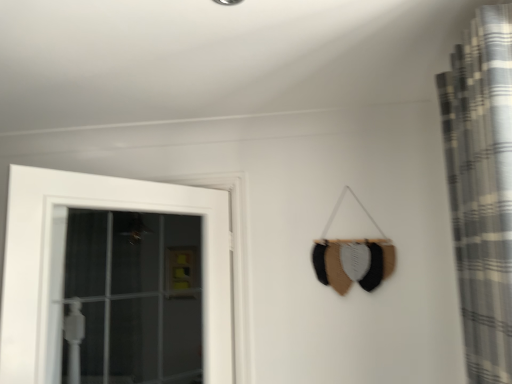
The width and height of the screenshot is (512, 384). Describe the element at coordinates (105, 209) in the screenshot. I see `white wooden door at left` at that location.

The width and height of the screenshot is (512, 384). Identify the location of white wooden door at left. (105, 209).

What is the approximate width of white wooden door at left?

white wooden door at left is 6.07 inches wide.

In order to face white wooden door at left, should I rotate leftwards or rightwards?

Turn left approximately 15.599 degrees to face it.

What do you see at coordinates (482, 187) in the screenshot? I see `plaid fabric curtain at right` at bounding box center [482, 187].

Locate an element on the screen. Image resolution: width=512 pixels, height=384 pixels. plaid fabric curtain at right is located at coordinates (482, 187).

What is the approximate width of plaid fabric curtain at right?

The width of plaid fabric curtain at right is 12.69 inches.

Image resolution: width=512 pixels, height=384 pixels. In order to click on white wooden door at left in this screenshot , I will do `click(105, 209)`.

In the image, is white wooden door at left on the left side or the right side of plaid fabric curtain at right?

In the image, white wooden door at left appears on the left side of plaid fabric curtain at right.

Which object is more forward, white wooden door at left or plaid fabric curtain at right?

plaid fabric curtain at right is in front.

Is point (203, 269) closer or farther from the camera than point (452, 212)?

Clearly, point (203, 269) is more distant from the camera than point (452, 212).

From the image's perspective, is white wooden door at left on plaid fabric curtain at right?

No.

From a real-world perspective, who is located lower, white wooden door at left or plaid fabric curtain at right?

white wooden door at left.

In terms of width, does white wooden door at left look wider or thinner when compared to plaid fabric curtain at right?

white wooden door at left is thinner than plaid fabric curtain at right.

From their relative heights in the image, would you say white wooden door at left is taller or shorter than plaid fabric curtain at right?

white wooden door at left is shorter than plaid fabric curtain at right.

Between white wooden door at left and plaid fabric curtain at right, which one has smaller size?

With smaller size is white wooden door at left.

Would you say plaid fabric curtain at right is part of white wooden door at left's contents?

Definitely not — plaid fabric curtain at right is not inside white wooden door at left.

Is white wooden door at left positioned far away from plaid fabric curtain at right?

Yes, white wooden door at left and plaid fabric curtain at right are located far from each other.

Is white wooden door at left positioned with its back to plaid fabric curtain at right?

That's right, white wooden door at left is facing away from plaid fabric curtain at right.

Can you tell me how much white wooden door at left and plaid fabric curtain at right differ in facing direction?

The facing directions of white wooden door at left and plaid fabric curtain at right are 35.5 degrees apart.

Measure the distance between white wooden door at left and plaid fabric curtain at right.

The distance of white wooden door at left from plaid fabric curtain at right is 1.09 meters.

What are the coordinates of `door located behind the plaid fabric curtain at right` in the screenshot? It's located at (105, 209).

Considering the relative positions of plaid fabric curtain at right and white wooden door at left in the image provided, is plaid fabric curtain at right to the right of white wooden door at left from the viewer's perspective?

Yes.

Is plaid fabric curtain at right positioned in front of white wooden door at left?

Yes, it is.

Considering the positions of points (505, 223) and (231, 355), is point (505, 223) farther from camera compared to point (231, 355)?

No, it is in front of (231, 355).

From the image's perspective, which is above, plaid fabric curtain at right or white wooden door at left?

plaid fabric curtain at right.

From a real-world perspective, which is physically above, plaid fabric curtain at right or white wooden door at left?

From a 3D spatial view, plaid fabric curtain at right is above.

Does plaid fabric curtain at right have a greater width compared to white wooden door at left?

Correct, the width of plaid fabric curtain at right exceeds that of white wooden door at left.

Which of these two, plaid fabric curtain at right or white wooden door at left, stands shorter?

With less height is white wooden door at left.

Is plaid fabric curtain at right bigger than white wooden door at left?

Indeed, plaid fabric curtain at right has a larger size compared to white wooden door at left.

Is plaid fabric curtain at right situated inside white wooden door at left or outside?

plaid fabric curtain at right exists outside the volume of white wooden door at left.

Is plaid fabric curtain at right far away from white wooden door at left?

→ Indeed, plaid fabric curtain at right is not near white wooden door at left.

Is plaid fabric curtain at right turned away from white wooden door at left?

No, plaid fabric curtain at right's orientation is not away from white wooden door at left.

Measure the distance between plaid fabric curtain at right and white wooden door at left.

A distance of 1.09 meters exists between plaid fabric curtain at right and white wooden door at left.

Where is `curtain above the white wooden door at left (from the image's perspective)`? curtain above the white wooden door at left (from the image's perspective) is located at coordinates (482, 187).

You are a GUI agent. You are given a task and a screenshot of the screen. Output one action in this format:
    pyautogui.click(x=<x>, y=<y>)
    Task: Click on the door below the plaid fabric curtain at right (from the image's perspective)
    This screenshot has width=512, height=384.
    Given the screenshot: What is the action you would take?
    pyautogui.click(x=105, y=209)

The width and height of the screenshot is (512, 384). I want to click on door below the plaid fabric curtain at right (from a real-world perspective), so coord(105,209).